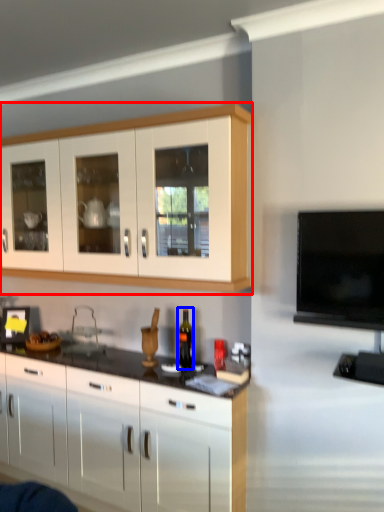
Question: Among these objects, which one is farthest to the camera, cabinetry (highlighted by a red box) or bottle (highlighted by a blue box)?

Choices:
 (A) cabinetry
 (B) bottle

Answer: (B)